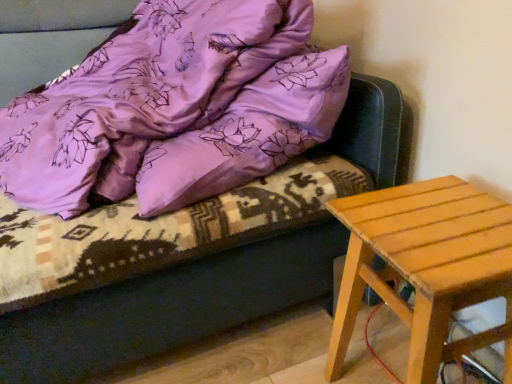
I want to click on blank space situated above wooden stool at right (from a real-world perspective), so click(448, 222).